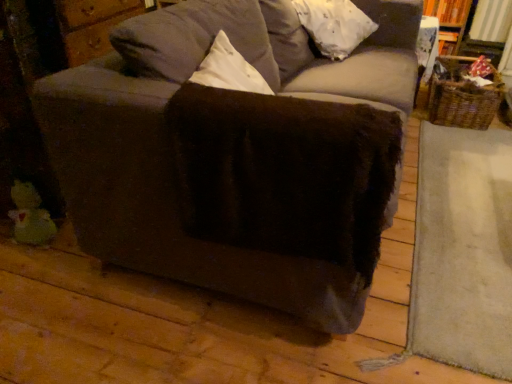
Question: Is velvet gray couch at center at the right side of woven brown basket at right?

Choices:
 (A) no
 (B) yes

Answer: (A)

Question: From the image's perspective, does velvet gray couch at center appear lower than woven brown basket at right?

Choices:
 (A) yes
 (B) no

Answer: (A)

Question: Is velvet gray couch at center placed right next to woven brown basket at right?

Choices:
 (A) no
 (B) yes

Answer: (A)

Question: Can you confirm if velvet gray couch at center is shorter than woven brown basket at right?

Choices:
 (A) no
 (B) yes

Answer: (A)

Question: Is velvet gray couch at center smaller than woven brown basket at right?

Choices:
 (A) yes
 (B) no

Answer: (B)

Question: From their relative heights in the image, would you say woven brown basket at right is taller or shorter than green plush duck at lower left?

Choices:
 (A) short
 (B) tall

Answer: (B)

Question: From a real-world perspective, is woven brown basket at right physically located above or below green plush duck at lower left?

Choices:
 (A) below
 (B) above

Answer: (B)

Question: From the image's perspective, is woven brown basket at right located above or below green plush duck at lower left?

Choices:
 (A) above
 (B) below

Answer: (A)

Question: Is woven brown basket at right to the left or to the right of green plush duck at lower left in the image?

Choices:
 (A) left
 (B) right

Answer: (B)

Question: From the image's perspective, relative to velvet gray couch at center, is woven brown basket at right above or below?

Choices:
 (A) below
 (B) above

Answer: (B)

Question: Considering the positions of woven brown basket at right and velvet gray couch at center in the image, is woven brown basket at right taller or shorter than velvet gray couch at center?

Choices:
 (A) short
 (B) tall

Answer: (A)

Question: From a real-world perspective, is woven brown basket at right above or below velvet gray couch at center?

Choices:
 (A) above
 (B) below

Answer: (B)

Question: Do you think woven brown basket at right is within velvet gray couch at center, or outside of it?

Choices:
 (A) outside
 (B) inside

Answer: (A)

Question: In terms of width, does green plush duck at lower left look wider or thinner when compared to white fluffy pillow at upper center?

Choices:
 (A) thin
 (B) wide

Answer: (A)

Question: Does point (25, 200) appear closer or farther from the camera than point (362, 23)?

Choices:
 (A) closer
 (B) farther

Answer: (A)